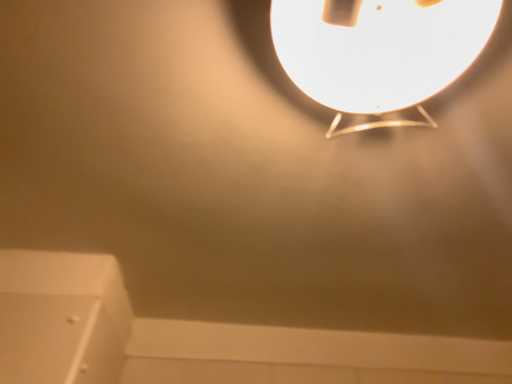
You are a GUI agent. You are given a task and a screenshot of the screen. Output one action in this format:
    pyautogui.click(x=<x>, y=<y>)
    Task: Click on the matte white lampshade at upper center
    
    Given the screenshot: What is the action you would take?
    pyautogui.click(x=378, y=53)

Measure the distance between point [334,83] and camera.

The distance of point [334,83] from camera is 22.28 inches.

The width and height of the screenshot is (512, 384). Describe the element at coordinates (378, 53) in the screenshot. I see `matte white lampshade at upper center` at that location.

I want to click on matte white lampshade at upper center, so click(x=378, y=53).